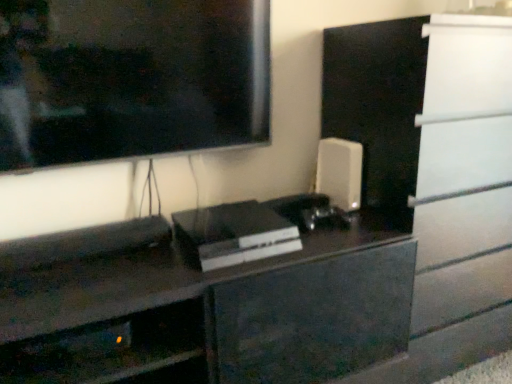
Question: Can you confirm if metallic gray shelf at lower left is wider than sleek black console at center, the first appliance positioned from the front?

Choices:
 (A) yes
 (B) no

Answer: (B)

Question: Considering the relative sizes of metallic gray shelf at lower left and sleek black console at center, arranged as the 1th appliance when viewed from the left, in the image provided, is metallic gray shelf at lower left bigger than sleek black console at center, arranged as the 1th appliance when viewed from the left,?

Choices:
 (A) no
 (B) yes

Answer: (A)

Question: Can you confirm if metallic gray shelf at lower left is positioned to the right of sleek black console at center, the 2th appliance in the right-to-left sequence?

Choices:
 (A) yes
 (B) no

Answer: (B)

Question: Considering the relative positions of metallic gray shelf at lower left and sleek black console at center, the 2th appliance in the right-to-left sequence, in the image provided, is metallic gray shelf at lower left to the left of sleek black console at center, the 2th appliance in the right-to-left sequence, from the viewer's perspective?

Choices:
 (A) yes
 (B) no

Answer: (A)

Question: Is the depth of metallic gray shelf at lower left less than that of sleek black console at center, arranged as the 1th appliance when viewed from the left?

Choices:
 (A) yes
 (B) no

Answer: (A)

Question: Is sleek black console at center, which appears as the 2th appliance when viewed from the back, at the back of metallic gray shelf at lower left?

Choices:
 (A) no
 (B) yes

Answer: (A)

Question: Can you confirm if white matte speaker at right, the first appliance from the back, is thinner than sleek black console at center, arranged as the 1th appliance when viewed from the left?

Choices:
 (A) yes
 (B) no

Answer: (A)

Question: Considering the relative sizes of white matte speaker at right, the first appliance from the back, and sleek black console at center, the first appliance positioned from the front, in the image provided, is white matte speaker at right, the first appliance from the back, shorter than sleek black console at center, the first appliance positioned from the front,?

Choices:
 (A) no
 (B) yes

Answer: (A)

Question: Considering the relative sizes of white matte speaker at right, which appears as the 1th appliance when viewed from the right, and sleek black console at center, the 2th appliance in the right-to-left sequence, in the image provided, is white matte speaker at right, which appears as the 1th appliance when viewed from the right, smaller than sleek black console at center, the 2th appliance in the right-to-left sequence,?

Choices:
 (A) no
 (B) yes

Answer: (B)

Question: Is white matte speaker at right, the first appliance from the back, positioned with its back to sleek black console at center, the 2th appliance in the right-to-left sequence?

Choices:
 (A) no
 (B) yes

Answer: (A)

Question: Is white matte speaker at right, the first appliance from the back, aimed at sleek black console at center, which appears as the 2th appliance when viewed from the back?

Choices:
 (A) yes
 (B) no

Answer: (B)

Question: Is white matte speaker at right, the first appliance from the back, far away from sleek black console at center, which appears as the 2th appliance when viewed from the back?

Choices:
 (A) no
 (B) yes

Answer: (A)

Question: Is white matte speaker at right, which is counted as the 2th appliance, starting from the front, wider than metallic gray shelf at lower left?

Choices:
 (A) yes
 (B) no

Answer: (B)